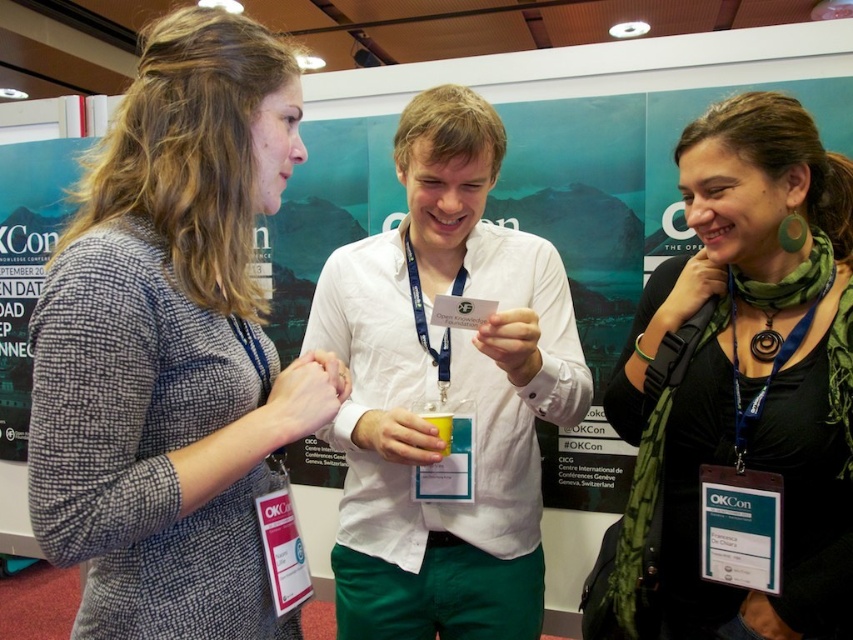
Question: Is gray woolen blazer at left positioned in front of black matte scarf at center?

Choices:
 (A) yes
 (B) no

Answer: (A)

Question: Is the position of gray woolen blazer at left less distant than that of black matte scarf at center?

Choices:
 (A) yes
 (B) no

Answer: (A)

Question: Which is nearer to the black matte scarf at center?

Choices:
 (A) gray woolen blazer at left
 (B) white cotton shirt at center

Answer: (B)

Question: Based on their relative distances, which object is farther from the gray woolen blazer at left?

Choices:
 (A) yellow plastic cup at center
 (B) white cotton shirt at center
 (C) black matte scarf at center

Answer: (C)

Question: Which of these objects is positioned farthest from the black matte scarf at center?

Choices:
 (A) white cotton shirt at center
 (B) gray woolen blazer at left

Answer: (B)

Question: Is black matte scarf at center behind white cotton shirt at center?

Choices:
 (A) yes
 (B) no

Answer: (B)